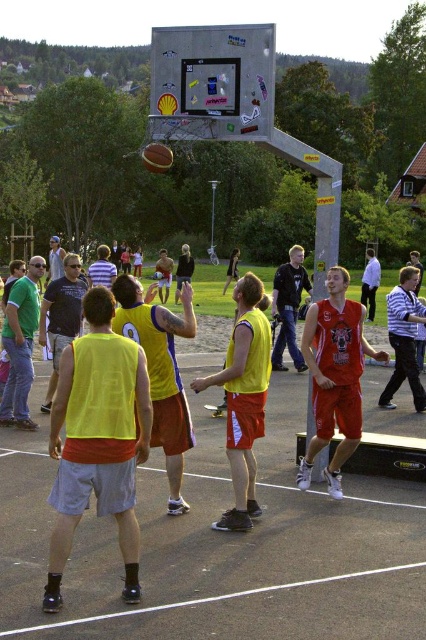
Question: Which object is closer to the camera taking this photo?

Choices:
 (A) rubber textured basketball at center
 (B) yellow jersey at center
 (C) matte black shirt at center
 (D) metallic gray basketball hoop at upper center

Answer: (B)

Question: Is neon yellow jersey at left wider than matte yellow jersey at center?

Choices:
 (A) no
 (B) yes

Answer: (A)

Question: Does matte red shorts at center appear on the left side of yellow jersey at center?

Choices:
 (A) no
 (B) yes

Answer: (A)

Question: Estimate the real-world distances between objects in this image. Which object is closer to the yellow fabric jersey at center?

Choices:
 (A) matte red shorts at center
 (B) neon yellow jersey at center
 (C) yellow jersey at center
 (D) rubber textured basketball at center

Answer: (A)

Question: Considering the real-world distances, which object is closest to the yellow matte jersey at center?

Choices:
 (A) neon yellow jersey at left
 (B) matte yellow jersey at center
 (C) neon yellow jersey at center

Answer: (C)

Question: Does neon yellow jersey at left have a larger size compared to matte black shirt at center?

Choices:
 (A) no
 (B) yes

Answer: (A)